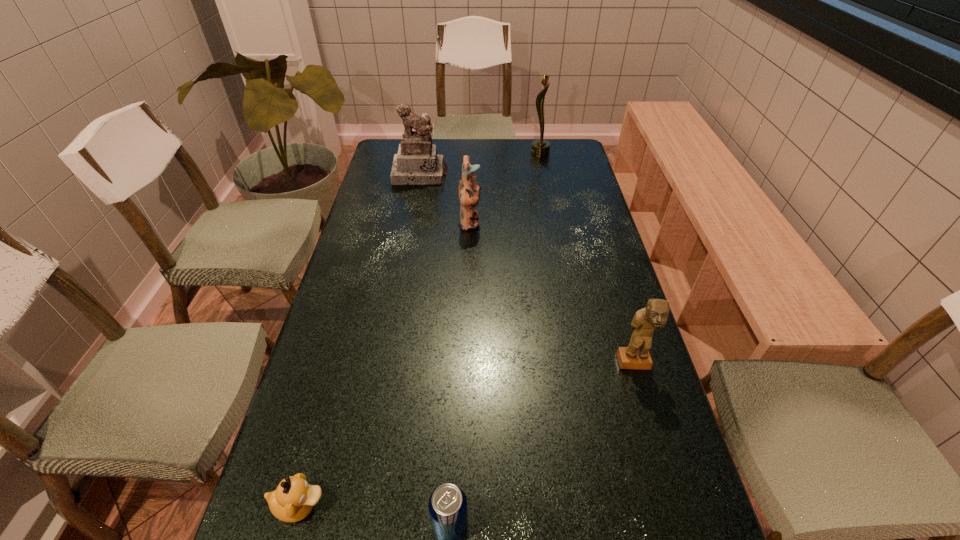
Locate an element on the screen. This screenshot has height=540, width=960. vacant position located on the front-facing side of the fifth object from left to right is located at coordinates (430, 154).

Locate an element on the screen. The height and width of the screenshot is (540, 960). vacant area located 0.370m on the front-facing side of the fifth object from left to right is located at coordinates (438, 154).

Where is `free space located on the front-facing side of the leftmost figurine`? free space located on the front-facing side of the leftmost figurine is located at coordinates (408, 240).

Image resolution: width=960 pixels, height=540 pixels. Find the location of `free location located on the front-facing side of the second nearest figurine`. free location located on the front-facing side of the second nearest figurine is located at coordinates (596, 223).

The width and height of the screenshot is (960, 540). I want to click on vacant space located 0.130m on the front-facing side of the third nearest object, so click(653, 427).

You are a GUI agent. You are given a task and a screenshot of the screen. Output one action in this format:
    pyautogui.click(x=<x>, y=<y>)
    Task: Click on the vacant space located on the face of the shortest object
    
    Given the screenshot: What is the action you would take?
    pyautogui.click(x=545, y=505)

You are a GUI agent. You are given a task and a screenshot of the screen. Output one action in this format:
    pyautogui.click(x=<x>, y=<y>)
    Task: Click on the award that is at the far edge
    
    Given the screenshot: What is the action you would take?
    pyautogui.click(x=540, y=148)

Find the location of a particular element. The height and width of the screenshot is (540, 960). figurine located at the far edge is located at coordinates (417, 163).

This screenshot has width=960, height=540. Find the location of `figurine present at the left edge`. figurine present at the left edge is located at coordinates (417, 163).

This screenshot has height=540, width=960. What are the coordinates of `duckling that is at the left edge` in the screenshot? It's located at pyautogui.click(x=293, y=500).